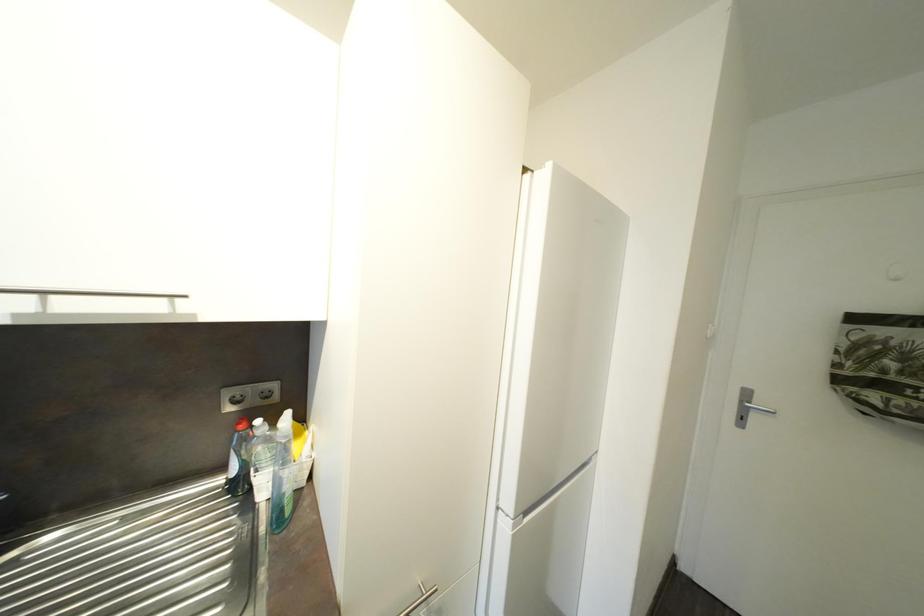
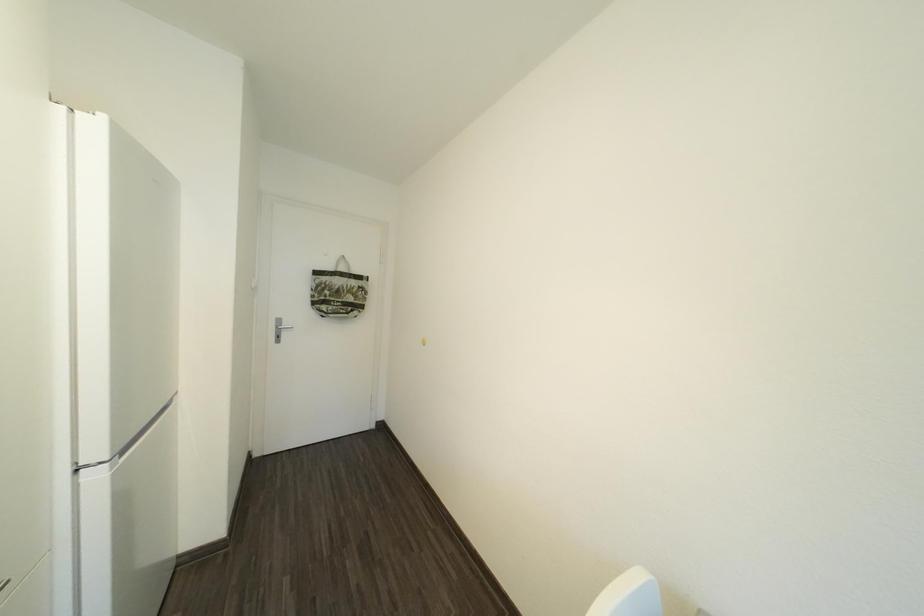
Question: The first image is from the beginning of the video and the second image is from the end. How did the camera likely rotate when shooting the video?

Choices:
 (A) Left
 (B) Right
 (C) Up
 (D) Down

Answer: (B)